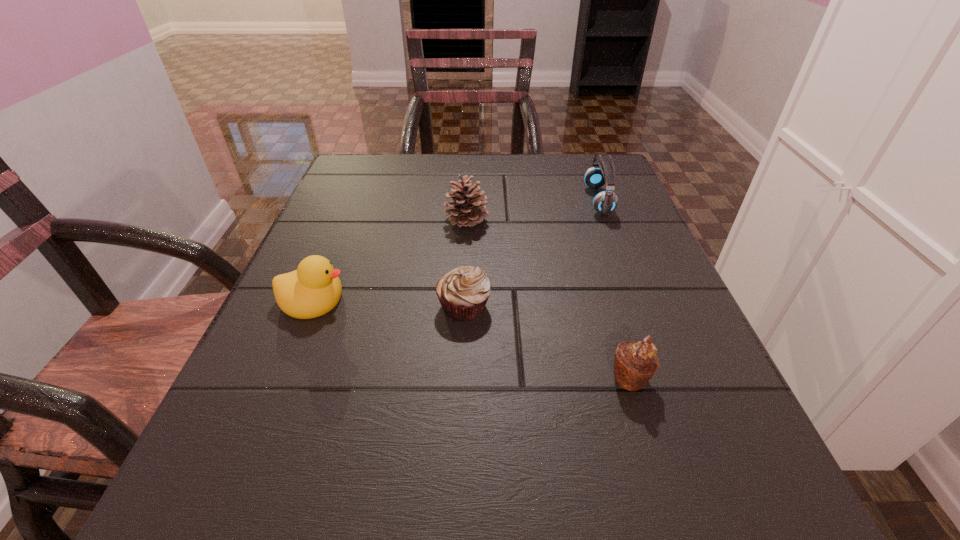
The height and width of the screenshot is (540, 960). What are the coordinates of `vacant region that satisfies the following two spatial constraints: 1. on the face of the leftmost object; 2. on the left side of the nearer muffin` in the screenshot? It's located at (281, 378).